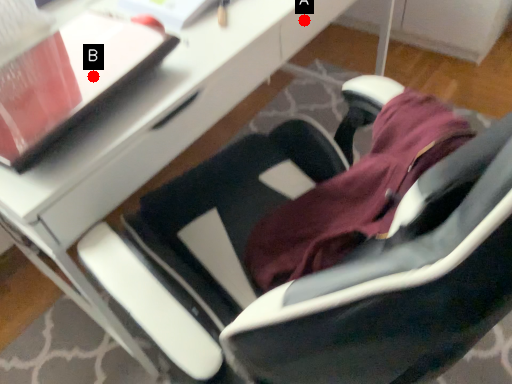
Question: Two points are circled on the image, labeled by A and B beside each circle. Which point is closer to the camera?

Choices:
 (A) A is closer
 (B) B is closer

Answer: (B)